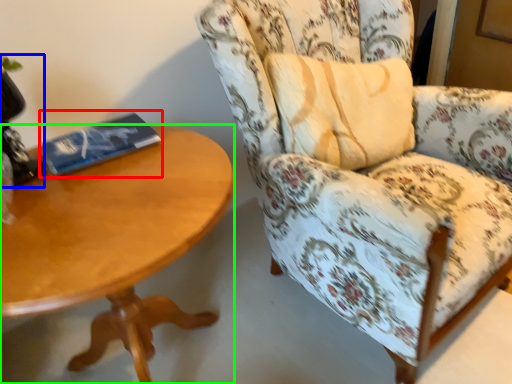
Question: Estimate the real-world distances between objects in this image. Which object is closer to paperback book (highlighted by a red box), table lamp (highlighted by a blue box) or coffee table (highlighted by a green box)?

Choices:
 (A) table lamp
 (B) coffee table

Answer: (A)